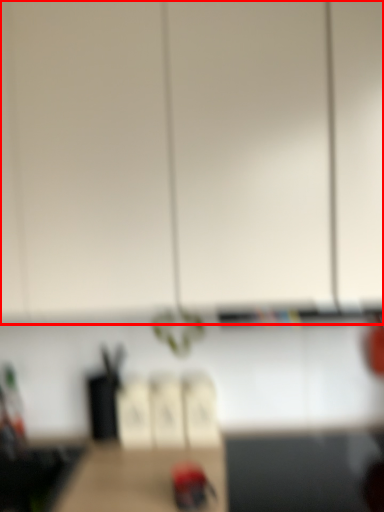
Question: From the image's perspective, what is the correct spatial relationship of cabinetry (annotated by the red box) in relation to woodpecker?

Choices:
 (A) above
 (B) below

Answer: (A)